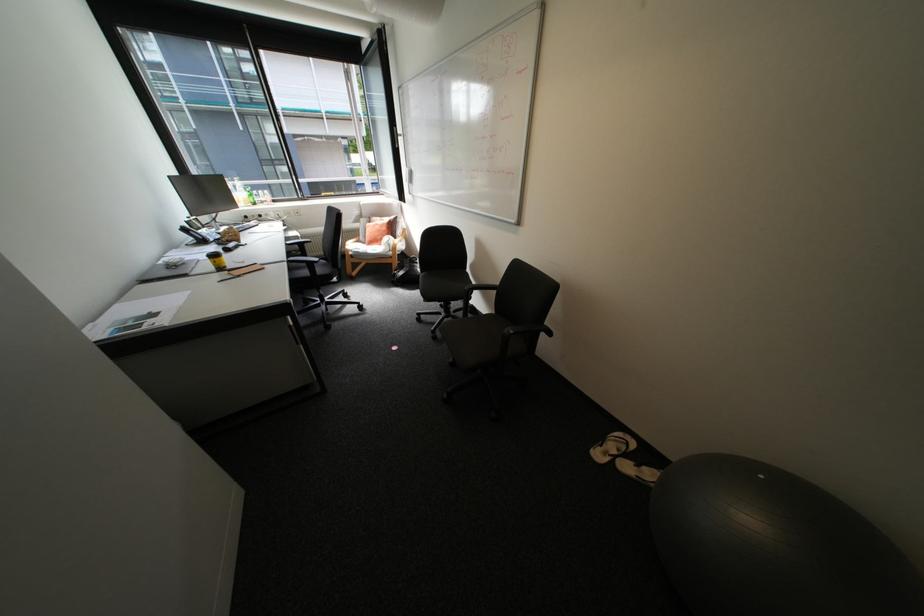
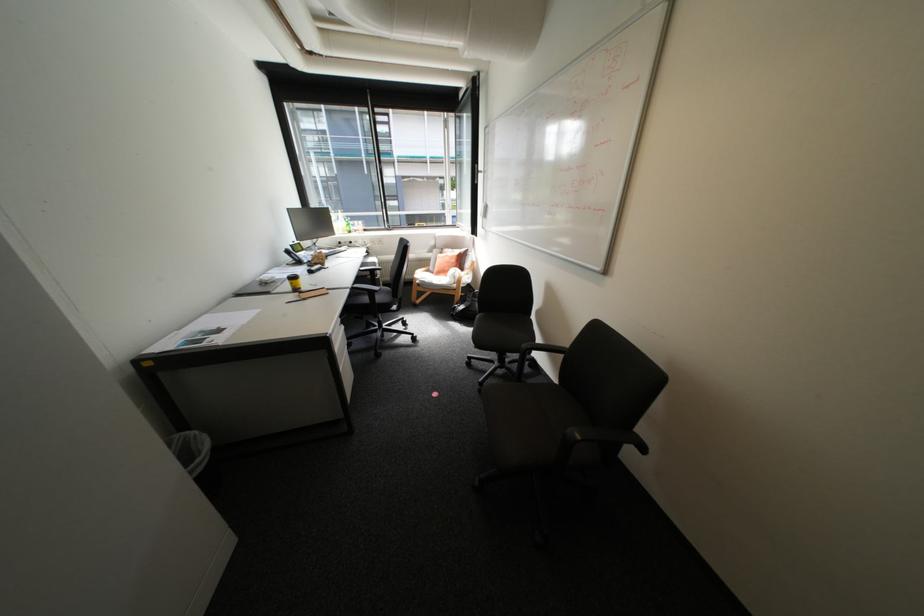
Locate, in the second image, the point that corresponds to the point at 417,291 in the first image.

(473, 326)